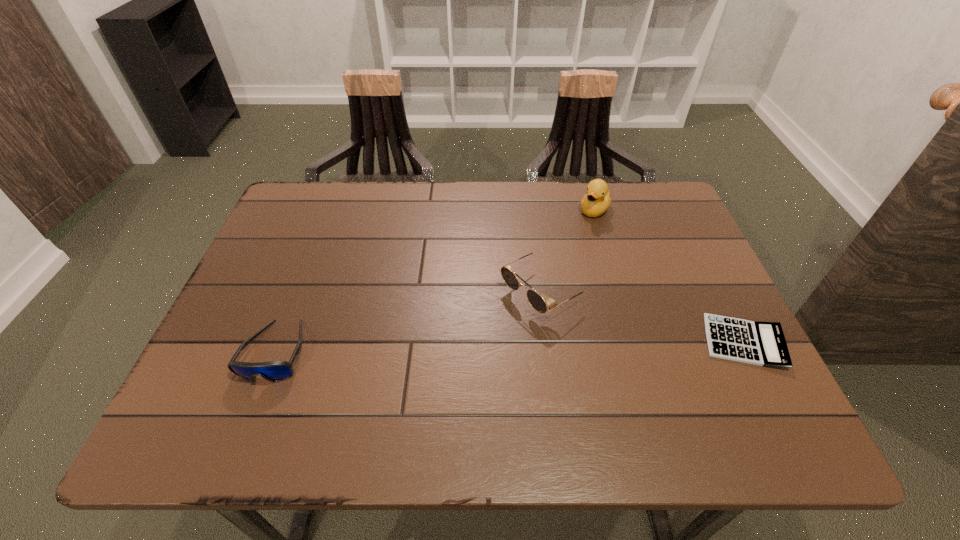
At what (x,y) coordinates should I click in order to perform the action: click on free space between the calculator and the third tallest object. Please return your answer as a coordinate pair (x, y). The image size is (960, 540). Looking at the image, I should click on (510, 347).

Identify the location of free spot between the calculator and the second shortest object. This screenshot has height=540, width=960. (510, 347).

The image size is (960, 540). In order to click on free area in between the calculator and the leftmost object in this screenshot , I will do `click(510, 347)`.

The width and height of the screenshot is (960, 540). Identify the location of unoccupied area between the duckling and the shortest object. (669, 276).

This screenshot has height=540, width=960. In order to click on vacant space that's between the right sunglasses and the left sunglasses in this screenshot , I will do point(410,321).

I want to click on empty location between the leftmost object and the tallest object, so click(x=436, y=280).

You are a GUI agent. You are given a task and a screenshot of the screen. Output one action in this format:
    pyautogui.click(x=<x>, y=<y>)
    Task: Click on the empty space that is in between the third tallest object and the farthest object
    The height and width of the screenshot is (540, 960).
    Given the screenshot: What is the action you would take?
    pyautogui.click(x=436, y=280)

You are a GUI agent. You are given a task and a screenshot of the screen. Output one action in this format:
    pyautogui.click(x=<x>, y=<y>)
    Task: Click on the free space between the third object from left to right and the second tallest object
    
    Given the screenshot: What is the action you would take?
    pyautogui.click(x=569, y=250)

At what (x,y) coordinates should I click in order to perform the action: click on vacant region between the taller sunglasses and the leftmost object. Please return your answer as a coordinate pair (x, y). The width and height of the screenshot is (960, 540). Looking at the image, I should click on (410, 321).

You are a GUI agent. You are given a task and a screenshot of the screen. Output one action in this format:
    pyautogui.click(x=<x>, y=<y>)
    Task: Click on the vacant area that lies between the farthest object and the shorter sunglasses
    
    Given the screenshot: What is the action you would take?
    pyautogui.click(x=436, y=280)